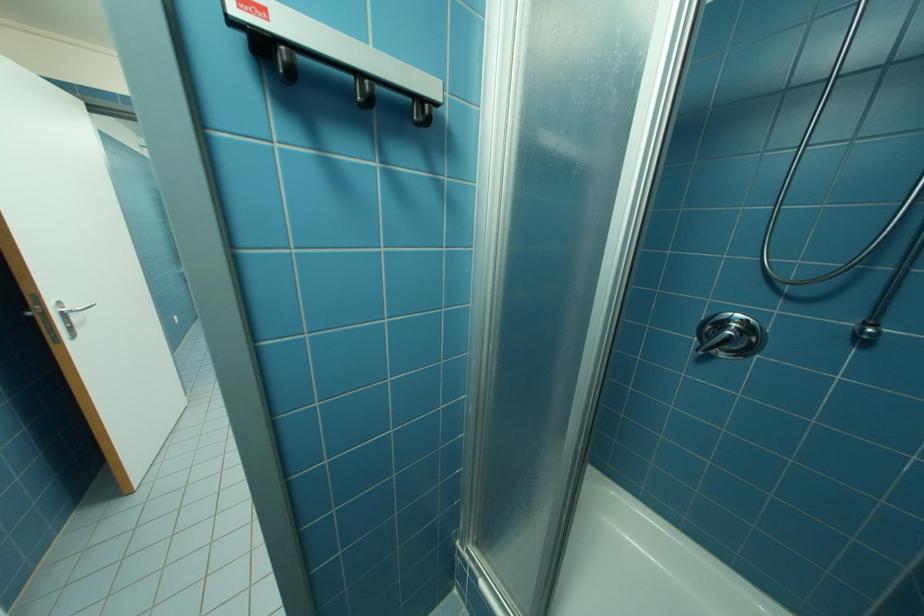
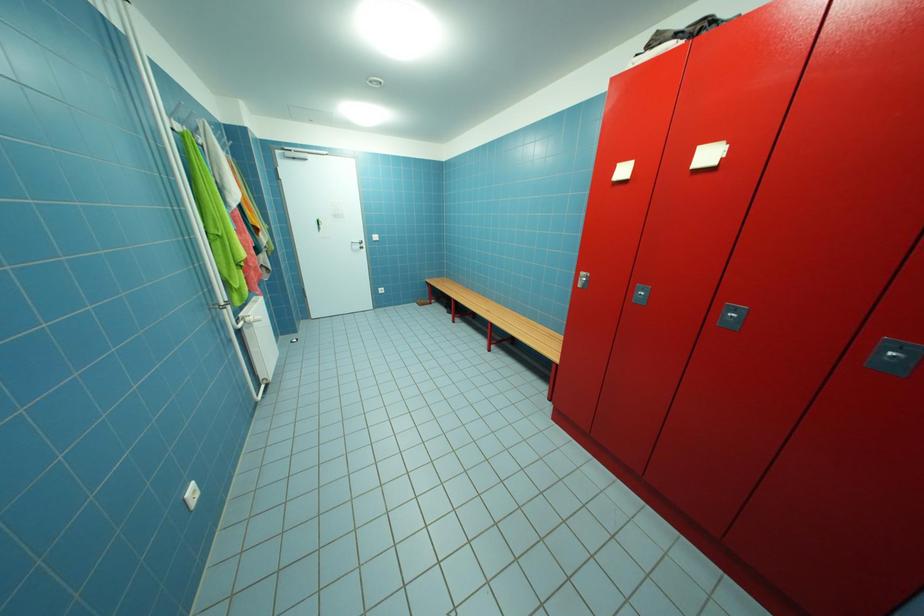
In a continuous first-person perspective shot, in which direction is the camera moving?

The cameraman walked toward left, forward.